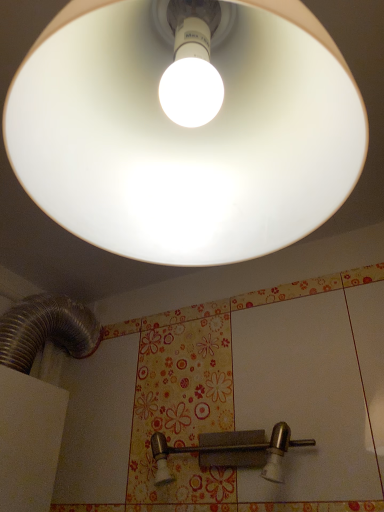
What is the approximate height of satin nickel lever at lower center?

satin nickel lever at lower center is 4.91 inches in height.

This screenshot has width=384, height=512. Describe the element at coordinates (232, 451) in the screenshot. I see `satin nickel lever at lower center` at that location.

What are the coordinates of `satin nickel lever at lower center` in the screenshot? It's located at (232, 451).

I want to click on matte white lampshade at upper center, so click(185, 139).

Image resolution: width=384 pixels, height=512 pixels. What do you see at coordinates (185, 139) in the screenshot?
I see `matte white lampshade at upper center` at bounding box center [185, 139].

The width and height of the screenshot is (384, 512). Identify the location of satin nickel lever at lower center. (232, 451).

Is satin nickel lever at lower center to the left or to the right of matte white lampshade at upper center in the image?

Based on their positions, satin nickel lever at lower center is located to the right of matte white lampshade at upper center.

Considering the positions of objects satin nickel lever at lower center and matte white lampshade at upper center in the image provided, who is behind, satin nickel lever at lower center or matte white lampshade at upper center?

Positioned behind is satin nickel lever at lower center.

Does point (272, 479) lie in front of point (41, 183)?

No, it is not.

From the image's perspective, is satin nickel lever at lower center located above or below matte white lampshade at upper center?

satin nickel lever at lower center is situated lower than matte white lampshade at upper center in the image.

From a real-world perspective, is satin nickel lever at lower center above or below matte white lampshade at upper center?

In terms of real-world spatial position, satin nickel lever at lower center is below matte white lampshade at upper center.

In terms of width, does satin nickel lever at lower center look wider or thinner when compared to matte white lampshade at upper center?

satin nickel lever at lower center is thinner than matte white lampshade at upper center.

Between satin nickel lever at lower center and matte white lampshade at upper center, which one has less height?

satin nickel lever at lower center is shorter.

Is satin nickel lever at lower center bigger or smaller than matte white lampshade at upper center?

Clearly, satin nickel lever at lower center is smaller in size than matte white lampshade at upper center.

Is satin nickel lever at lower center positioned beyond the bounds of matte white lampshade at upper center?

satin nickel lever at lower center is positioned outside matte white lampshade at upper center.

Is satin nickel lever at lower center next to matte white lampshade at upper center?

No, satin nickel lever at lower center is not next to matte white lampshade at upper center.

Is satin nickel lever at lower center facing away from matte white lampshade at upper center?

satin nickel lever at lower center does not have its back to matte white lampshade at upper center.

Where is `lamp above the satin nickel lever at lower center (from a real-world perspective)`? lamp above the satin nickel lever at lower center (from a real-world perspective) is located at coordinates (185, 139).

Based on their positions, is matte white lampshade at upper center located to the left or right of satin nickel lever at lower center?

matte white lampshade at upper center is positioned on satin nickel lever at lower center's left side.

Relative to satin nickel lever at lower center, is matte white lampshade at upper center in front or behind?

Clearly, matte white lampshade at upper center is in front of satin nickel lever at lower center.

Considering the positions of points (121, 90) and (273, 477), is point (121, 90) farther from camera compared to point (273, 477)?

No, (121, 90) is closer to viewer.

From the image's perspective, which is below, matte white lampshade at upper center or satin nickel lever at lower center?

satin nickel lever at lower center is shown below in the image.

From a real-world perspective, is matte white lampshade at upper center positioned under satin nickel lever at lower center based on gravity?

No, from a real-world perspective, matte white lampshade at upper center is not below satin nickel lever at lower center.

Which object is wider, matte white lampshade at upper center or satin nickel lever at lower center?

matte white lampshade at upper center.

From their relative heights in the image, would you say matte white lampshade at upper center is taller or shorter than satin nickel lever at lower center?

In the image, matte white lampshade at upper center appears to be taller than satin nickel lever at lower center.

Can you confirm if matte white lampshade at upper center is bigger than satin nickel lever at lower center?

Yes.

Is matte white lampshade at upper center located outside satin nickel lever at lower center?

matte white lampshade at upper center is positioned outside satin nickel lever at lower center.

Is matte white lampshade at upper center directly adjacent to satin nickel lever at lower center?

They are not placed beside each other.

Is matte white lampshade at upper center positioned with its back to satin nickel lever at lower center?

Yes, matte white lampshade at upper center's orientation is away from satin nickel lever at lower center.

How distant is matte white lampshade at upper center from satin nickel lever at lower center?

matte white lampshade at upper center and satin nickel lever at lower center are 25.23 inches apart from each other.

Where is `door handle located below the matte white lampshade at upper center (from the image's perspective)`? The image size is (384, 512). door handle located below the matte white lampshade at upper center (from the image's perspective) is located at coordinates (232, 451).

Find the location of a particular element. This screenshot has height=512, width=384. door handle below the matte white lampshade at upper center (from the image's perspective) is located at coordinates (232, 451).

Identify the location of lamp lying on the left of satin nickel lever at lower center. The height and width of the screenshot is (512, 384). (185, 139).